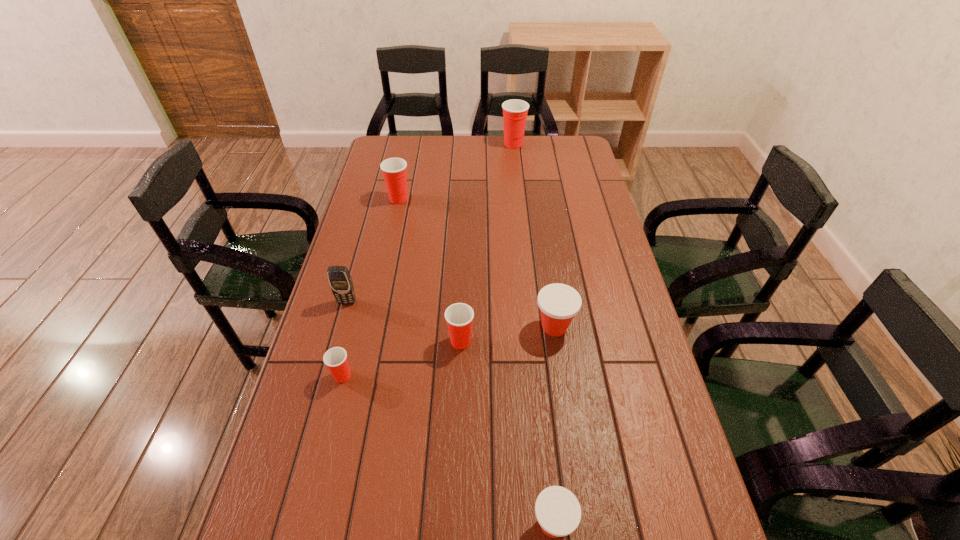
Locate which red Dixie cup is the third closest to the cellular telephone. Please provide its 2D coordinates. Your answer should be formatted as a tuple, i.e. [(x, y)], where the tuple contains the x and y coordinates of a point satisfying the conditions above.

[(394, 170)]

The width and height of the screenshot is (960, 540). In order to click on free region that satisfies the following two spatial constraints: 1. on the back side of the nearest red Dixie cup; 2. on the right side of the biggest red Dixie cup in this screenshot , I will do `click(400, 144)`.

Where is `free spot that satisfies the following two spatial constraints: 1. on the front face of the nearest red Dixie cup; 2. on the right side of the third farthest object`? The height and width of the screenshot is (540, 960). free spot that satisfies the following two spatial constraints: 1. on the front face of the nearest red Dixie cup; 2. on the right side of the third farthest object is located at coordinates (326, 376).